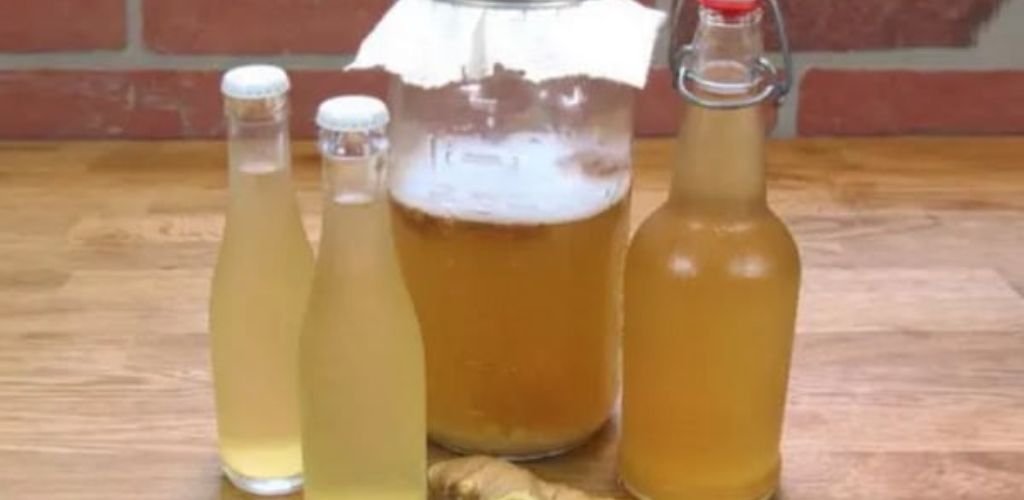
Find the location of `brick wall`. brick wall is located at coordinates (152, 90).